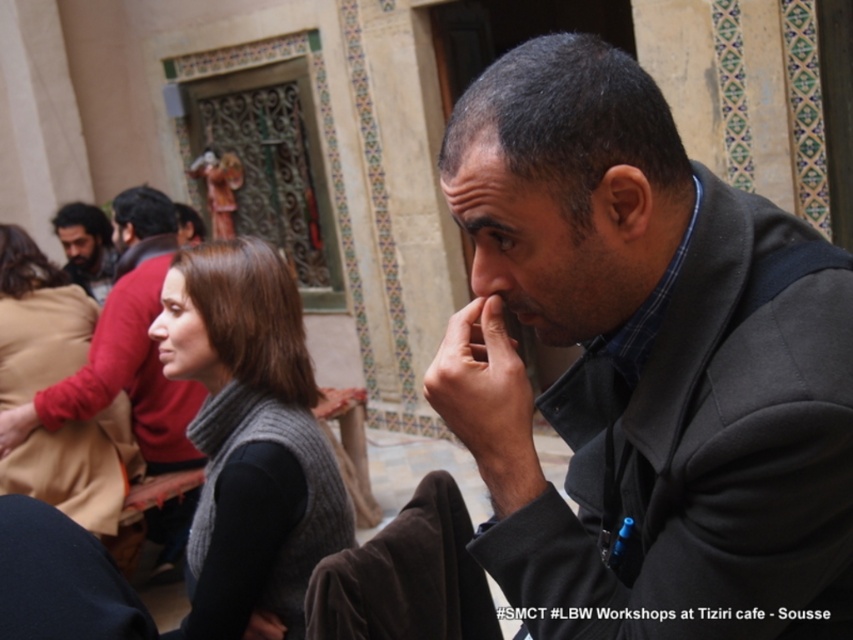
Question: Which object is the farthest from the matte brown leather hand at lower left?

Choices:
 (A) matte black hand at lower center
 (B) matte black nose at center

Answer: (B)

Question: Does gray knitted vest at center have a larger size compared to matte brown leather hand at lower left?

Choices:
 (A) yes
 (B) no

Answer: (A)

Question: Which object appears farthest from the camera in this image?

Choices:
 (A) matte brown leather hand at lower left
 (B) matte black hand at lower center
 (C) gray knitted vest at center

Answer: (A)

Question: Can you confirm if dark gray suit at center is positioned to the right of matte black hand at lower center?

Choices:
 (A) yes
 (B) no

Answer: (A)

Question: Is dark brown hair at left positioned before matte black nose at center?

Choices:
 (A) no
 (B) yes

Answer: (B)

Question: Which point appears farthest from the camera in this image?

Choices:
 (A) (242, 464)
 (B) (61, 218)

Answer: (B)